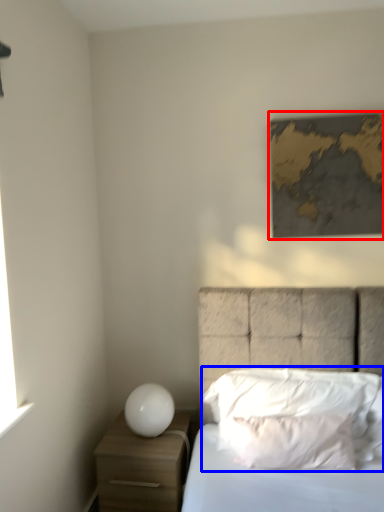
Question: Which of the following is the farthest to the observer, picture frame (highlighted by a red box) or pillow (highlighted by a blue box)?

Choices:
 (A) picture frame
 (B) pillow

Answer: (A)